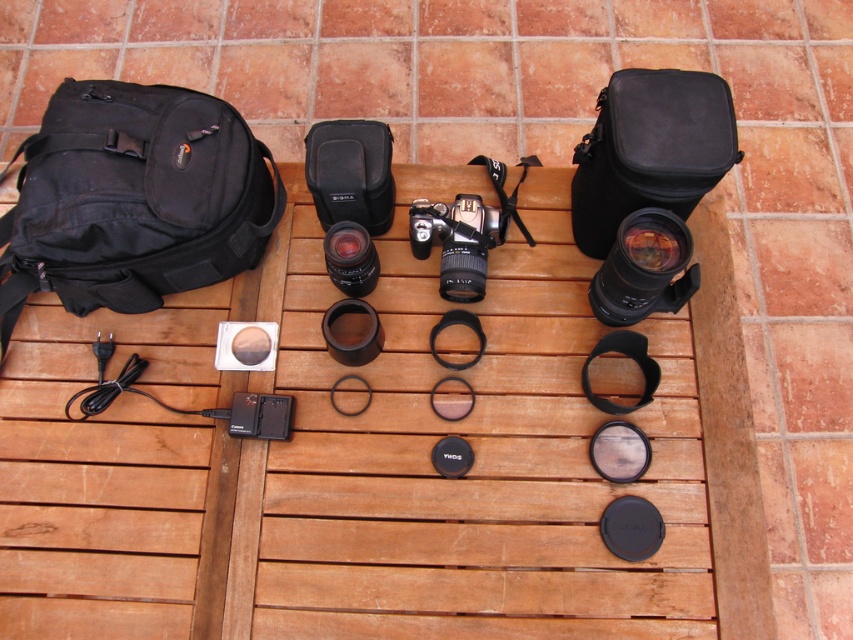
Question: From the image, what is the correct spatial relationship of wooden at upper center in relation to matte black camera at upper right?

Choices:
 (A) above
 (B) below

Answer: (B)

Question: Which point appears closest to the camera in this image?

Choices:
 (A) (6, 356)
 (B) (415, 240)

Answer: (B)

Question: Among these points, which one is nearest to the camera?

Choices:
 (A) (657, 250)
 (B) (129, 234)

Answer: (A)

Question: Which object appears closest to the camera in this image?

Choices:
 (A) black fabric backpack at upper left
 (B) satin black camera at center
 (C) matte black camera at upper right

Answer: (C)

Question: In this image, where is wooden at upper center located relative to satin black camera at center?

Choices:
 (A) left
 (B) right

Answer: (A)

Question: From the image, what is the correct spatial relationship of wooden at upper center in relation to black fabric camera bag at upper right?

Choices:
 (A) above
 (B) below

Answer: (B)